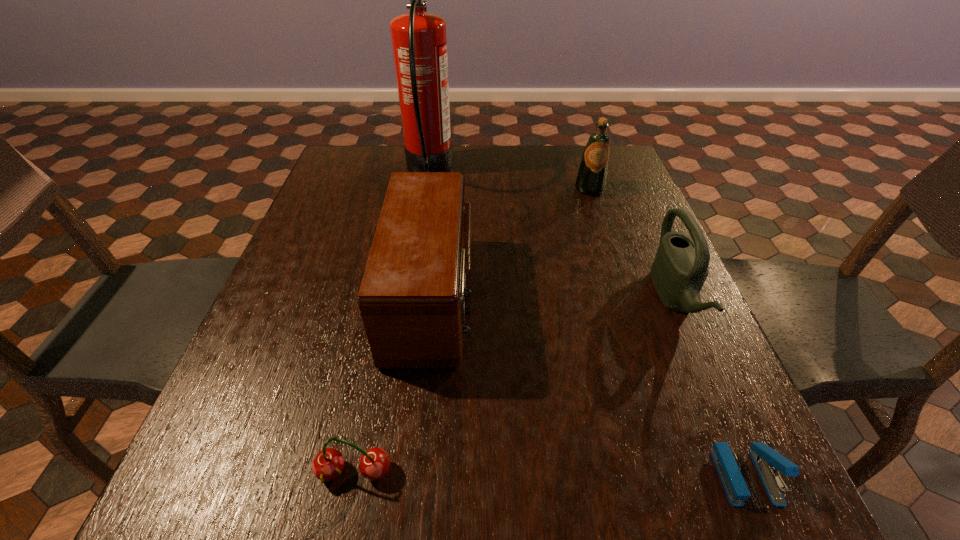
In order to click on free spot that satisfies the following two spatial constraints: 1. on the spout of the watering can; 2. with stems pointing upwards on the second shortest object in this screenshot , I will do coord(749,472).

What are the coordinates of `free space that satisfies the following two spatial constraints: 1. on the back side of the shortest object; 2. on the front-facing side of the radio receiver` in the screenshot? It's located at (669, 296).

Image resolution: width=960 pixels, height=540 pixels. I want to click on free point that satisfies the following two spatial constraints: 1. on the back side of the shortest object; 2. on the front-facing side of the tallest object, so click(615, 170).

Where is `free space that satisfies the following two spatial constraints: 1. on the front-facing side of the stapler; 2. on the left side of the tallest object`? free space that satisfies the following two spatial constraints: 1. on the front-facing side of the stapler; 2. on the left side of the tallest object is located at coordinates (380, 476).

The image size is (960, 540). In order to click on free space that satisfies the following two spatial constraints: 1. on the front-facing side of the fire extinguisher; 2. on the back side of the stapler in this screenshot , I will do `click(380, 476)`.

Locate an element on the screen. This screenshot has width=960, height=540. vacant position in the image that satisfies the following two spatial constraints: 1. on the front-facing side of the fire extinguisher; 2. with stems pointing upwards on the fifth tallest object is located at coordinates (381, 472).

Find the location of a particular element. vacant position in the image that satisfies the following two spatial constraints: 1. on the spout of the watering can; 2. with stems pointing upwards on the cherry is located at coordinates (749, 472).